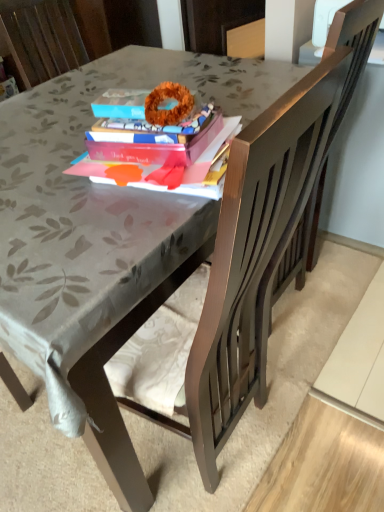
Where is `dark brown wood swivel chair at right`? The height and width of the screenshot is (512, 384). dark brown wood swivel chair at right is located at coordinates [342, 94].

Describe the element at coordinates (342, 94) in the screenshot. The height and width of the screenshot is (512, 384). I see `dark brown wood swivel chair at right` at that location.

What do you see at coordinates (161, 153) in the screenshot? The image size is (384, 512). I see `matte pink book at center` at bounding box center [161, 153].

Identify the location of matte pink book at center. (161, 153).

This screenshot has height=512, width=384. Identify the location of dark brown wood swivel chair at right. (342, 94).

From the picture: Would you say matte pink book at center is to the left or to the right of dark brown wood swivel chair at right in the picture?

In the image, matte pink book at center appears on the left side of dark brown wood swivel chair at right.

Is the position of matte pink book at center more distant than that of dark brown wood swivel chair at right?

No, it is not.

Which is more distant, (185, 123) or (319, 192)?

Positioned behind is point (319, 192).

From the image's perspective, is matte pink book at center on top of dark brown wood swivel chair at right?

No, from the image's perspective, matte pink book at center is not above dark brown wood swivel chair at right.

From a real-world perspective, which object rests below the other?

dark brown wood swivel chair at right is physically lower.

Between matte pink book at center and dark brown wood swivel chair at right, which one has smaller width?

matte pink book at center.

Who is shorter, matte pink book at center or dark brown wood swivel chair at right?

Standing shorter between the two is matte pink book at center.

Considering the relative sizes of matte pink book at center and dark brown wood swivel chair at right in the image provided, is matte pink book at center bigger than dark brown wood swivel chair at right?

No.

Is matte pink book at center positioned beyond the bounds of dark brown wood swivel chair at right?

Yes.

Is matte pink book at center beside dark brown wood swivel chair at right?

There is a gap between matte pink book at center and dark brown wood swivel chair at right.

Is matte pink book at center positioned with its back to dark brown wood swivel chair at right?

matte pink book at center is not turned away from dark brown wood swivel chair at right.

The height and width of the screenshot is (512, 384). What are the coordinates of `book in front of the dark brown wood swivel chair at right` in the screenshot? It's located at (161, 153).

Considering the relative positions of dark brown wood swivel chair at right and matte pink book at center in the image provided, is dark brown wood swivel chair at right to the left of matte pink book at center from the viewer's perspective?

In fact, dark brown wood swivel chair at right is to the right of matte pink book at center.

Is dark brown wood swivel chair at right in front of matte pink book at center?

No, it is behind matte pink book at center.

Which point is more distant from viewer, [313,220] or [213,160]?

The point [313,220] is more distant.

From the image's perspective, who appears lower, dark brown wood swivel chair at right or matte pink book at center?

matte pink book at center is shown below in the image.

From a real-world perspective, which is physically below, dark brown wood swivel chair at right or matte pink book at center?

dark brown wood swivel chair at right.

Is dark brown wood swivel chair at right wider than matte pink book at center?

Yes, dark brown wood swivel chair at right is wider than matte pink book at center.

Who is shorter, dark brown wood swivel chair at right or matte pink book at center?

matte pink book at center is shorter.

Is dark brown wood swivel chair at right bigger or smaller than matte pink book at center?

In the image, dark brown wood swivel chair at right appears to be larger than matte pink book at center.

Is dark brown wood swivel chair at right completely or partially outside of matte pink book at center?

Indeed, dark brown wood swivel chair at right is completely outside matte pink book at center.

Would you say dark brown wood swivel chair at right is a long distance from matte pink book at center?

No, there isn't a large distance between dark brown wood swivel chair at right and matte pink book at center.

Is dark brown wood swivel chair at right oriented away from matte pink book at center?

No.

How many degrees apart are the facing directions of dark brown wood swivel chair at right and matte pink book at center?

They differ by 172 degrees in their facing directions.

You are a GUI agent. You are given a task and a screenshot of the screen. Output one action in this format:
    pyautogui.click(x=<x>, y=<y>)
    Task: Click on the swivel chair that appears above the matte pink book at center (from the image's perspective)
    The image size is (384, 512).
    Given the screenshot: What is the action you would take?
    pyautogui.click(x=342, y=94)

What are the coordinates of `book lying on the left of dark brown wood swivel chair at right` in the screenshot? It's located at (161, 153).

I want to click on book above the dark brown wood swivel chair at right (from a real-world perspective), so click(x=161, y=153).